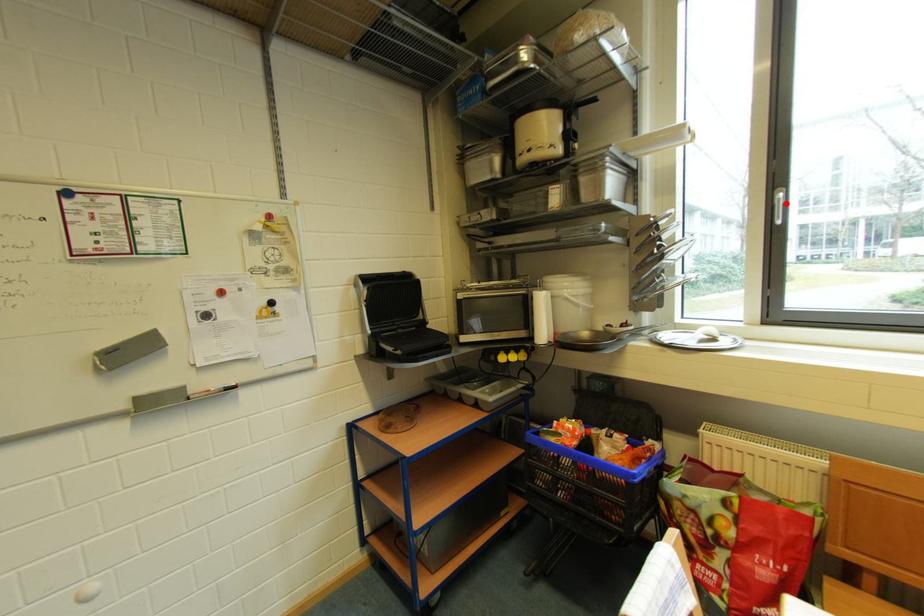
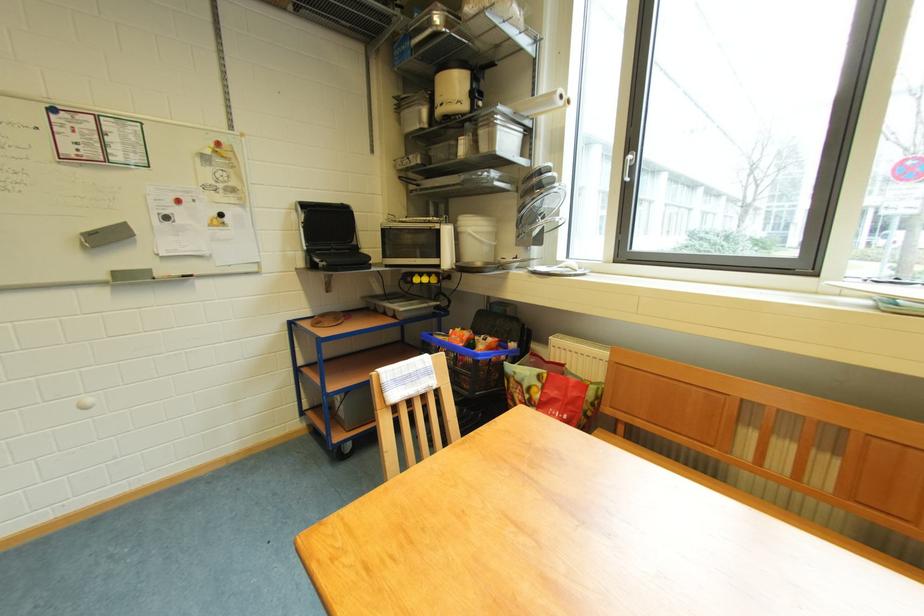
Question: I am providing you with two images of the same scene from different viewpoints. Given a red point in image1, look at the same physical point in image2. Is it:

Choices:
 (A) Closer to the viewpoint
 (B) Farther from the viewpoint

Answer: (A)